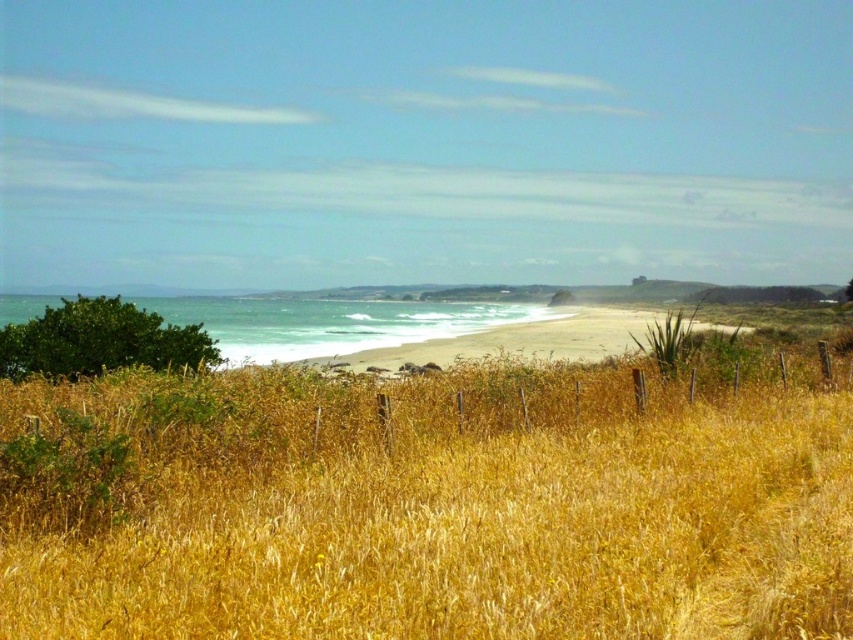
Question: Which object appears farthest from the camera in this image?

Choices:
 (A) white sandy beach at center
 (B) dry golden grass at center

Answer: (A)

Question: Does dry golden grass at center have a smaller size compared to white sandy beach at center?

Choices:
 (A) no
 (B) yes

Answer: (B)

Question: Among these objects, which one is nearest to the camera?

Choices:
 (A) white sandy beach at center
 (B) dry golden grass at center

Answer: (B)

Question: From the image, what is the correct spatial relationship of dry golden grass at center in relation to white sandy beach at center?

Choices:
 (A) below
 (B) above

Answer: (A)

Question: Is dry golden grass at center bigger than white sandy beach at center?

Choices:
 (A) yes
 (B) no

Answer: (B)